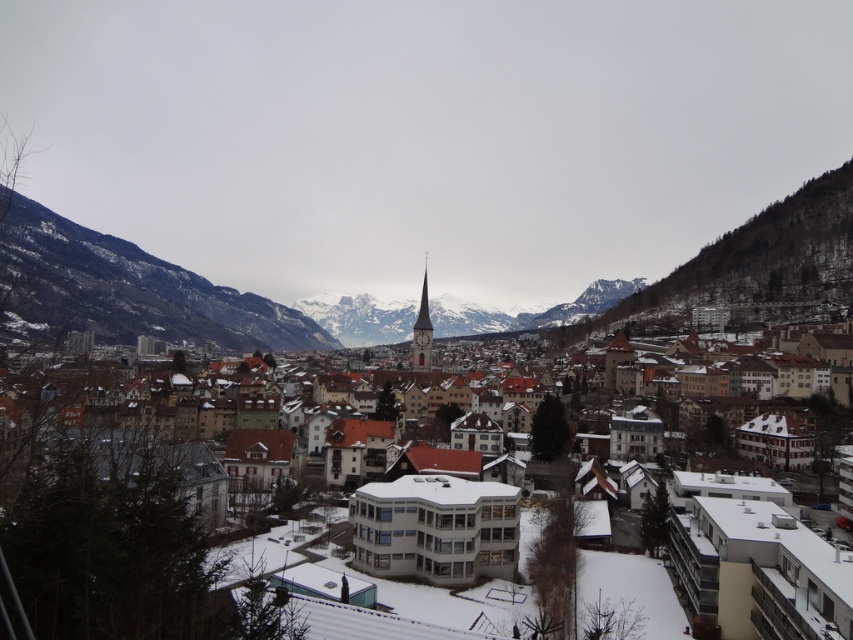
Question: Can you confirm if white matte building at center is bigger than rocky brown mountain at left?

Choices:
 (A) yes
 (B) no

Answer: (B)

Question: Is white matte building at center positioned at the back of rocky brown mountain at left?

Choices:
 (A) yes
 (B) no

Answer: (B)

Question: Which point is farther to the camera?

Choices:
 (A) white matte building at center
 (B) rocky brown mountain at left

Answer: (B)

Question: Can you confirm if white matte building at center is smaller than rocky brown mountain at left?

Choices:
 (A) yes
 (B) no

Answer: (A)

Question: Which object appears closest to the camera in this image?

Choices:
 (A) white matte building at center
 (B) rocky brown mountain at left

Answer: (A)

Question: Which of the following is the closest to the observer?

Choices:
 (A) (9, 556)
 (B) (291, 344)

Answer: (A)